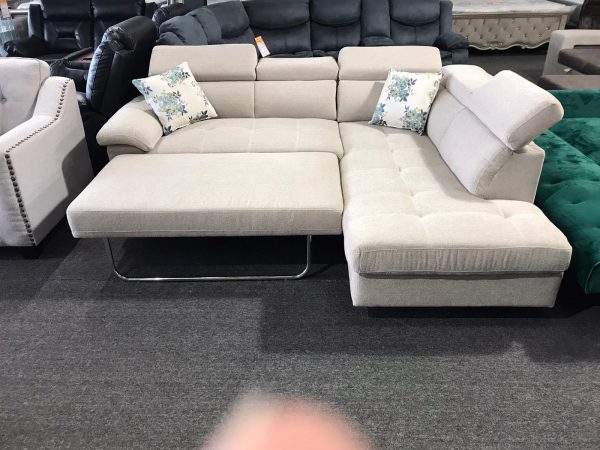
Locate an element on the screen. floral pillows is located at coordinates (410, 90), (177, 101).